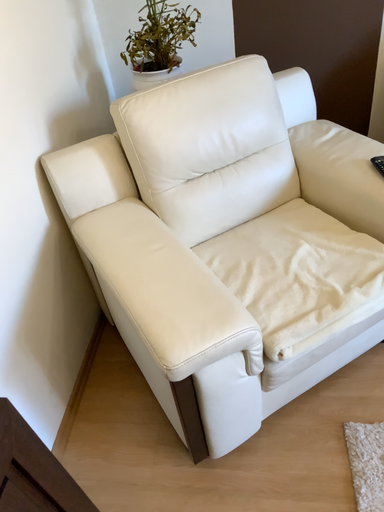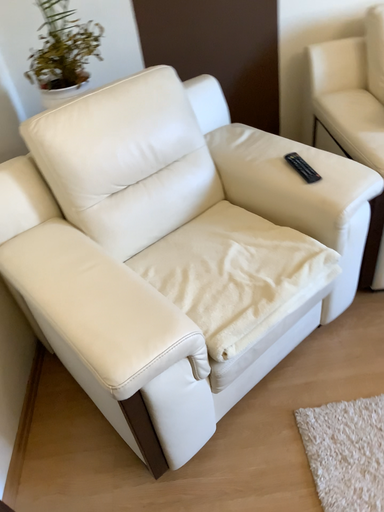
Question: How did the camera likely rotate when shooting the video?

Choices:
 (A) rotated right
 (B) rotated left

Answer: (A)